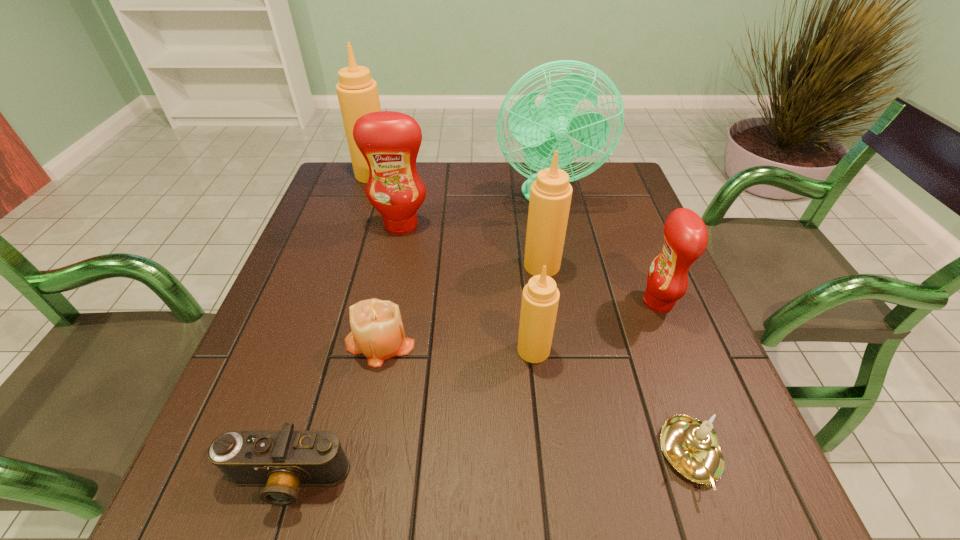
Locate an element on the screen. This screenshot has height=540, width=960. free spot located on the label side of the rightmost condiment is located at coordinates (541, 302).

Locate an element on the screen. This screenshot has height=540, width=960. free region located 0.270m on the label side of the rightmost condiment is located at coordinates (518, 302).

At what (x,y) coordinates should I click in order to perform the action: click on free space located 0.300m on the right of the beige candle. Please return your answer as a coordinate pair (x, y). Image resolution: width=960 pixels, height=540 pixels. Looking at the image, I should click on click(x=564, y=342).

At what (x,y) coordinates should I click in order to perform the action: click on fan located at the far edge. Please return your answer as a coordinate pair (x, y). Looking at the image, I should click on (546, 128).

The width and height of the screenshot is (960, 540). I want to click on condiment that is positioned at the far edge, so click(x=357, y=92).

The height and width of the screenshot is (540, 960). What are the coordinates of `candle holder that is positioned at the near edge` in the screenshot? It's located at (691, 446).

Identify the location of camera positioned at the near edge. The width and height of the screenshot is (960, 540). (282, 460).

You are a GUI agent. You are given a task and a screenshot of the screen. Output one action in this format:
    pyautogui.click(x=<x>, y=<y>)
    Task: Click on the condiment at the left edge
    
    Given the screenshot: What is the action you would take?
    pyautogui.click(x=357, y=92)

Find the location of a particular element. This screenshot has height=540, width=960. camera that is at the left edge is located at coordinates (282, 460).

At what (x,y) coordinates should I click in order to perform the action: click on fan that is at the right edge. Please return your answer as a coordinate pair (x, y). The width and height of the screenshot is (960, 540). Looking at the image, I should click on (546, 128).